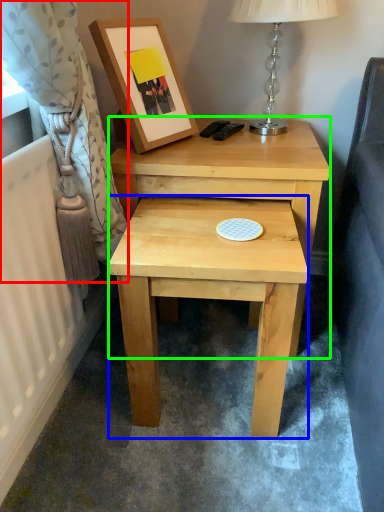
Question: Which object is positioned closest to curtain (highlighted by a red box)? Select from stool (highlighted by a blue box) and nightstand (highlighted by a green box).

Choices:
 (A) stool
 (B) nightstand

Answer: (A)